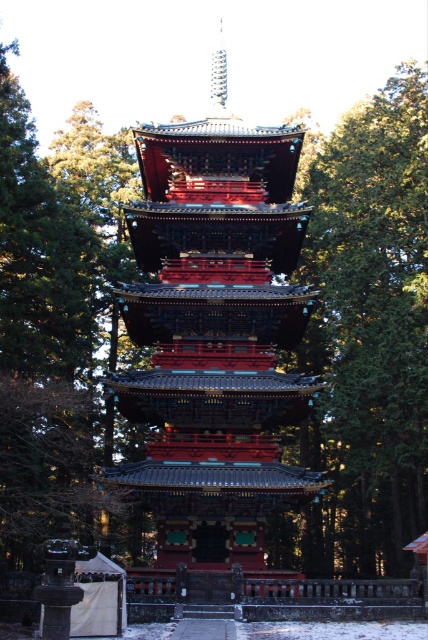
From the picture: Can you confirm if shiny lacquered pagoda at center is wider than green textured tree at center?

Yes, shiny lacquered pagoda at center is wider than green textured tree at center.

What do you see at coordinates (214, 333) in the screenshot? Image resolution: width=428 pixels, height=640 pixels. I see `shiny lacquered pagoda at center` at bounding box center [214, 333].

Is point (145, 291) less distant than point (326, 442)?

Yes.

Locate an element on the screen. This screenshot has height=640, width=428. shiny lacquered pagoda at center is located at coordinates (214, 333).